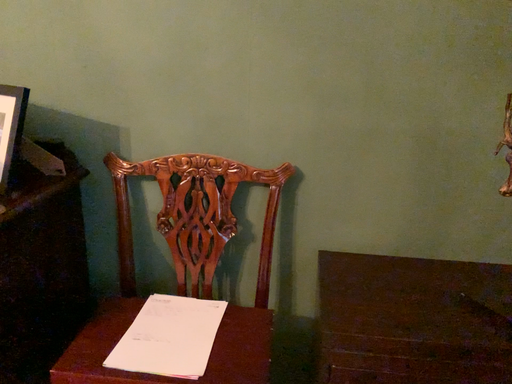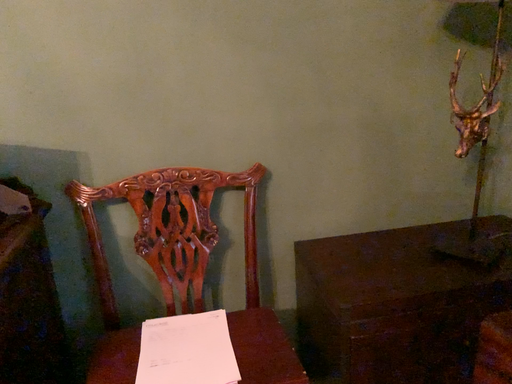
Question: How did the camera likely rotate when shooting the video?

Choices:
 (A) rotated left
 (B) rotated right

Answer: (B)